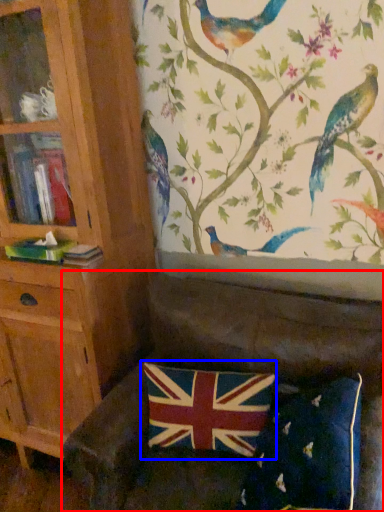
Question: Which of the following is the closest to the observer, studio couch (highlighted by a red box) or flag (highlighted by a blue box)?

Choices:
 (A) studio couch
 (B) flag

Answer: (A)